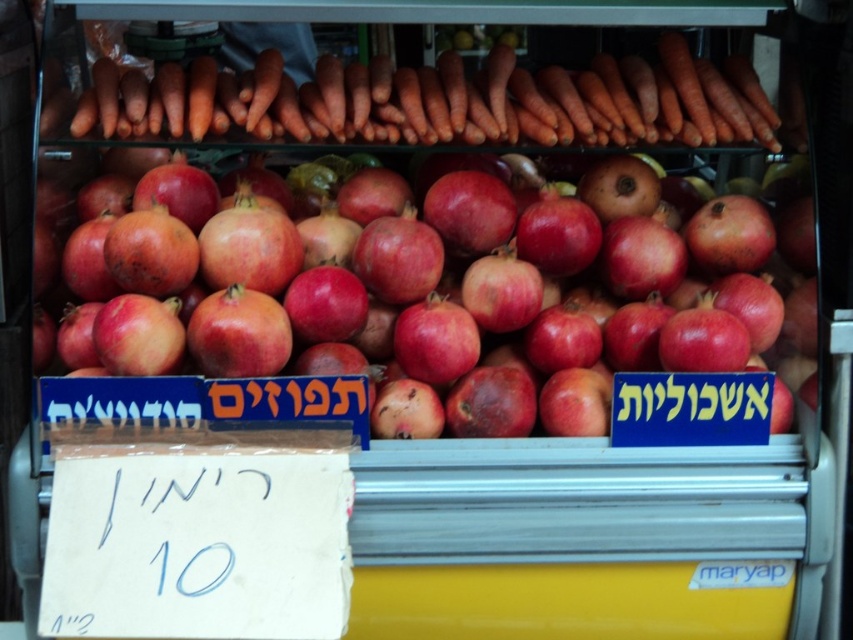
You are a customer at the market stall and want to know which item is taller between the shiny red pomegranate at center and the orange smooth carrots at upper center. Can you tell me?

The shiny red pomegranate at center is taller than the orange smooth carrots at upper center according to the description.

You are a customer at the market stall and want to buy a fruit that is smaller in width than the carrots. Which one should you choose between the shiny red pomegranate at center and the orange smooth carrots at upper center?

The shiny red pomegranate at center has a smaller width than the orange smooth carrots at upper center, so you should choose the shiny red pomegranate at center.

You are a customer at the market stall looking at the display case. You want to grab the shiny red pomegranate at center and the orange smooth carrots at upper center. Which one is easier to reach without moving any items?

The shiny red pomegranate at center is closer to the viewer than the orange smooth carrots at upper center, so it is easier to reach without moving any items.